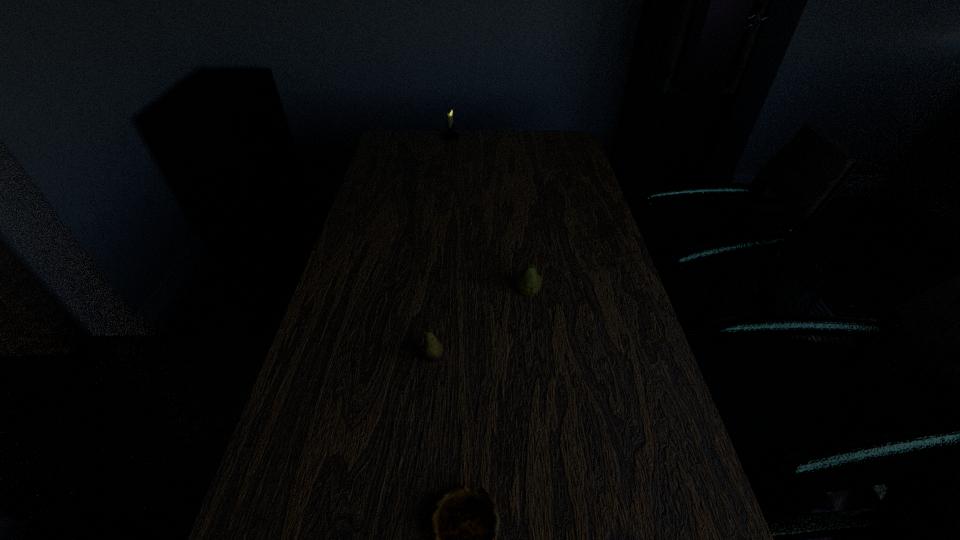
Where is `object that is the nearest to the farther pear`? Image resolution: width=960 pixels, height=540 pixels. object that is the nearest to the farther pear is located at coordinates (431, 351).

Locate an element on the screen. Image resolution: width=960 pixels, height=540 pixels. vacant position in the image that satisfies the following two spatial constraints: 1. on the back side of the rightmost object; 2. on the left side of the nearer pear is located at coordinates (439, 292).

This screenshot has width=960, height=540. What are the coordinates of `free location that satisfies the following two spatial constraints: 1. on the back side of the second nearest object; 2. on the right side of the right pear` in the screenshot? It's located at (439, 292).